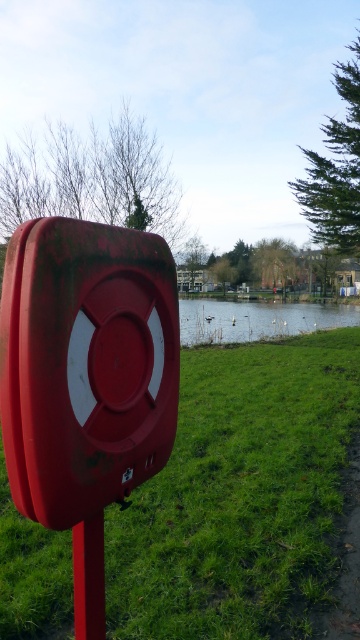
Question: Considering the relative positions of green grassy water at center and smooth glossy red pole at lower left in the image provided, where is green grassy water at center located with respect to smooth glossy red pole at lower left?

Choices:
 (A) right
 (B) left

Answer: (A)

Question: Which of the following is the farthest from the observer?

Choices:
 (A) rusty plastic lifebuoy at center
 (B) smooth glossy red pole at lower left
 (C) green grassy at center
 (D) green grassy water at center

Answer: (C)

Question: Among these points, which one is nearest to the camera?

Choices:
 (A) (263, 602)
 (B) (16, 417)
 (C) (192, 336)

Answer: (B)

Question: Is green grassy water at center below smooth glossy red pole at lower left?

Choices:
 (A) yes
 (B) no

Answer: (B)

Question: Does rusty plastic lifebuoy at center have a smaller size compared to smooth glossy red pole at lower left?

Choices:
 (A) yes
 (B) no

Answer: (B)

Question: Considering the real-world distances, which object is closest to the smooth glossy red pole at lower left?

Choices:
 (A) green grassy water at center
 (B) green grassy at center

Answer: (B)